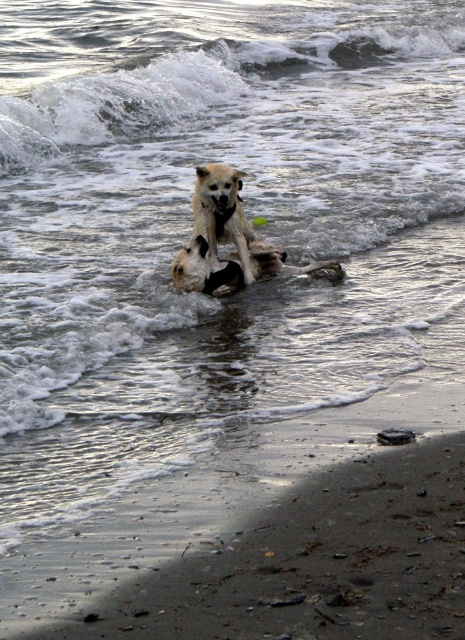
Is white frothy wave at upper center smaller than light brown fur dog at center?

Incorrect, white frothy wave at upper center is not smaller in size than light brown fur dog at center.

Is white frothy wave at upper center behind light brown fur dog at center?

Yes, white frothy wave at upper center is behind light brown fur dog at center.

Describe the element at coordinates (226, 80) in the screenshot. I see `white frothy wave at upper center` at that location.

Locate an element on the screen. Image resolution: width=465 pixels, height=640 pixels. white frothy wave at upper center is located at coordinates (226, 80).